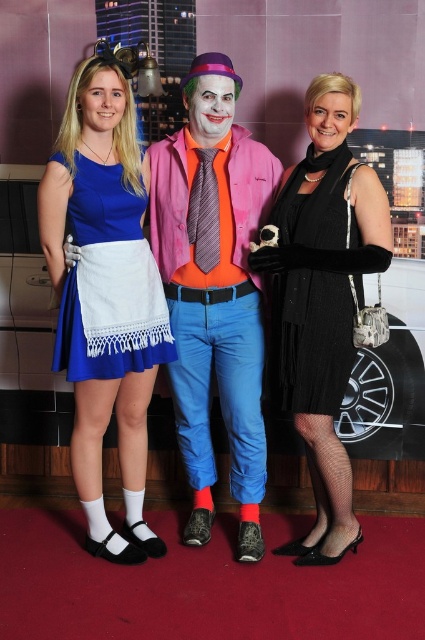
Which is below, black textured dress at center or black knitted dress at right?

black textured dress at center is below.

The width and height of the screenshot is (425, 640). What do you see at coordinates (323, 300) in the screenshot? I see `black textured dress at center` at bounding box center [323, 300].

What do you see at coordinates (323, 300) in the screenshot? This screenshot has width=425, height=640. I see `black textured dress at center` at bounding box center [323, 300].

Where is `black textured dress at center`? The width and height of the screenshot is (425, 640). black textured dress at center is located at coordinates (323, 300).

Which is in front, point (342, 529) or point (85, 269)?

Positioned in front is point (85, 269).

Is point (297, 221) more distant than point (127, 333)?

No.

Locate an element on the screen. This screenshot has height=640, width=425. black textured dress at center is located at coordinates (323, 300).

Can you confirm if blue cotton dress at left is shorter than black knitted dress at right?

No, blue cotton dress at left is not shorter than black knitted dress at right.

Between point (135, 452) and point (275, 216), which one is positioned behind?

The point (135, 452) is behind.

Is point (98, 72) positioned in front of point (329, 301)?

That is True.

Identify the location of blue cotton dress at left. This screenshot has width=425, height=640. tap(79, 301).